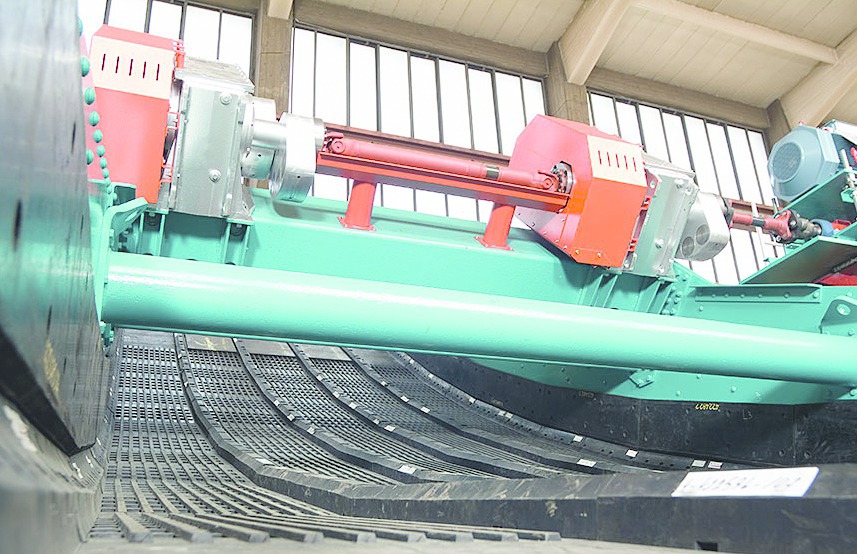
At what (x,y) coordinates should I click in order to perform the action: click on center piece. Please return your answer as a coordinate pair (x, y). This screenshot has height=554, width=857. Looking at the image, I should click on (578, 494).